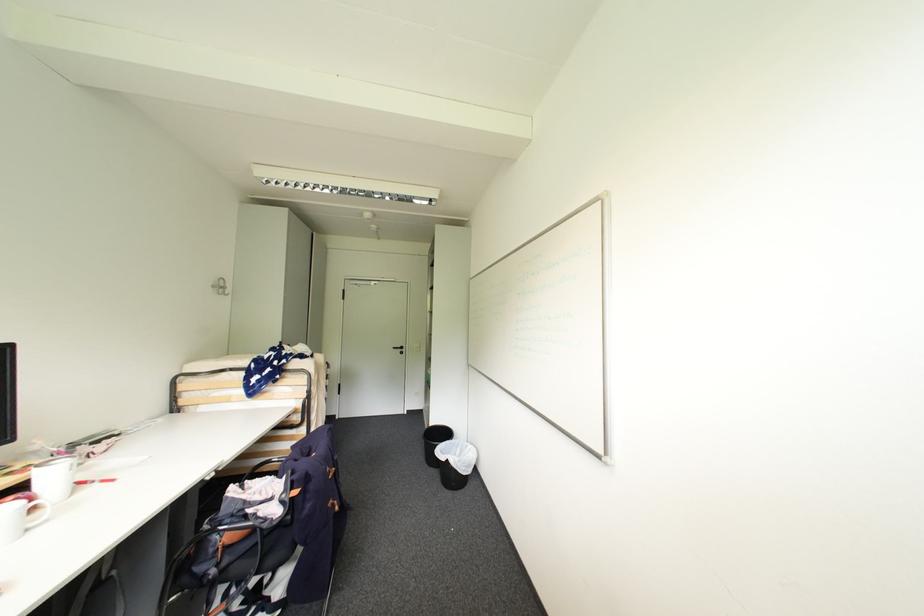
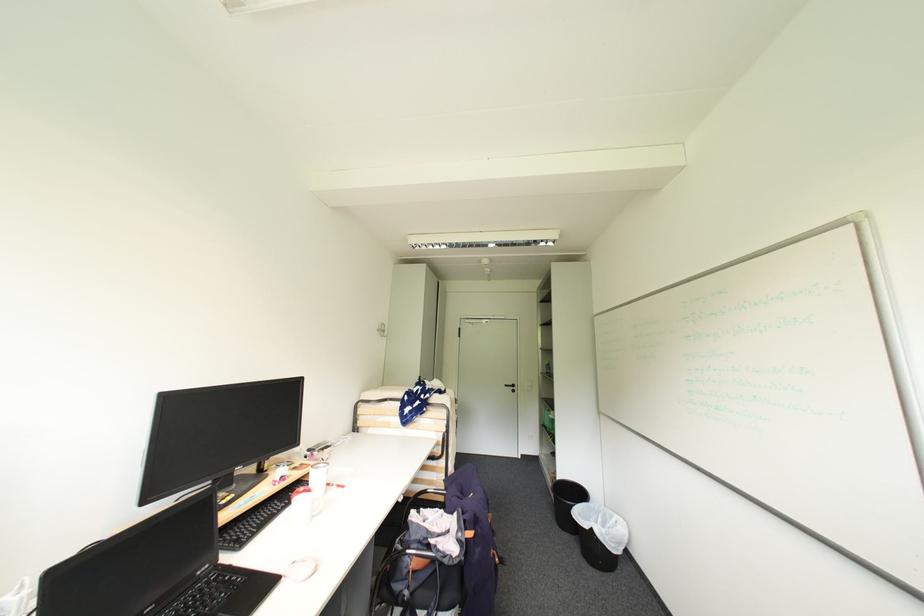
In the second image, find the point that corresponds to the point at 220,286 in the first image.

(384, 331)